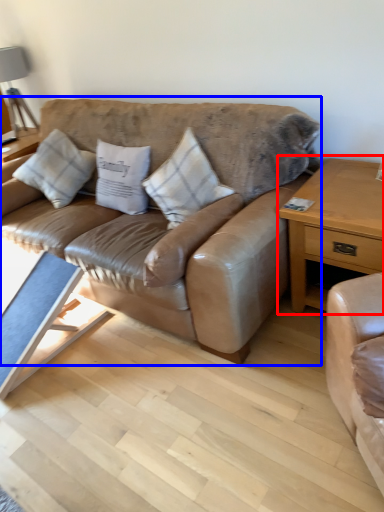
Question: Which of the following is the farthest to the observer, nightstand (highlighted by a red box) or studio couch (highlighted by a blue box)?

Choices:
 (A) nightstand
 (B) studio couch

Answer: (A)